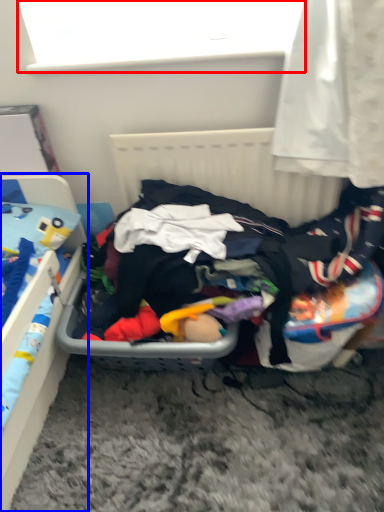
Question: Which object is closer to the camera taking this photo, window screen (highlighted by a red box) or furniture (highlighted by a blue box)?

Choices:
 (A) window screen
 (B) furniture

Answer: (B)